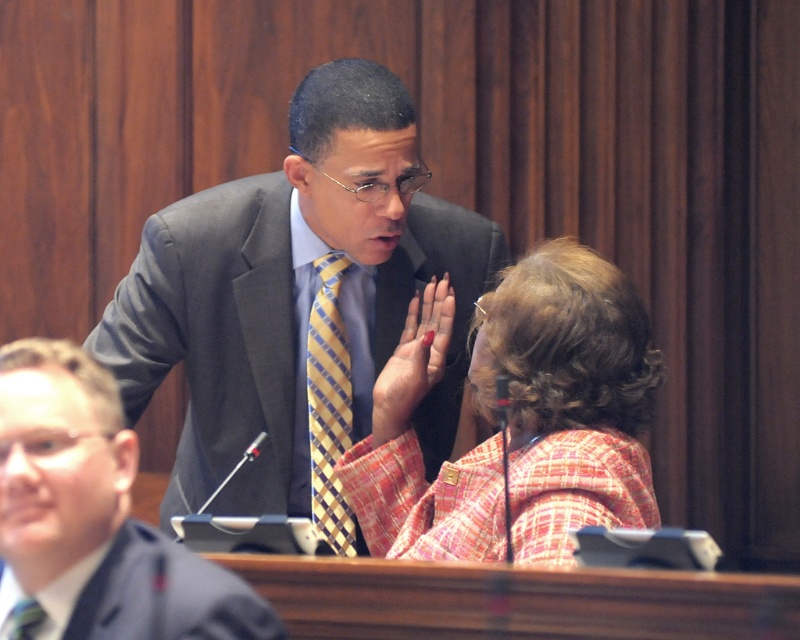
Question: Is matte gray suit at center thinner than matte black suit at lower left?

Choices:
 (A) yes
 (B) no

Answer: (B)

Question: Can you confirm if matte black suit at lower left is positioned to the left of yellow plaid tie at upper center?

Choices:
 (A) yes
 (B) no

Answer: (B)

Question: Does matte black suit at center have a greater width compared to matte black suit at lower left?

Choices:
 (A) yes
 (B) no

Answer: (A)

Question: Which object is the closest to the yellow plaid tie at upper center?

Choices:
 (A) matte black suit at center
 (B) matte black suit at lower left
 (C) matte gray suit at center
 (D) yellow checkered tie at center

Answer: (A)

Question: Which is farther from the yellow plaid tie at upper center?

Choices:
 (A) plaid fabric jacket at center
 (B) matte black suit at lower left
 (C) matte gray suit at center
 (D) matte black suit at center

Answer: (A)

Question: Which of these objects is positioned closest to the matte black suit at center?

Choices:
 (A) yellow plaid tie at upper center
 (B) matte black suit at lower left

Answer: (B)